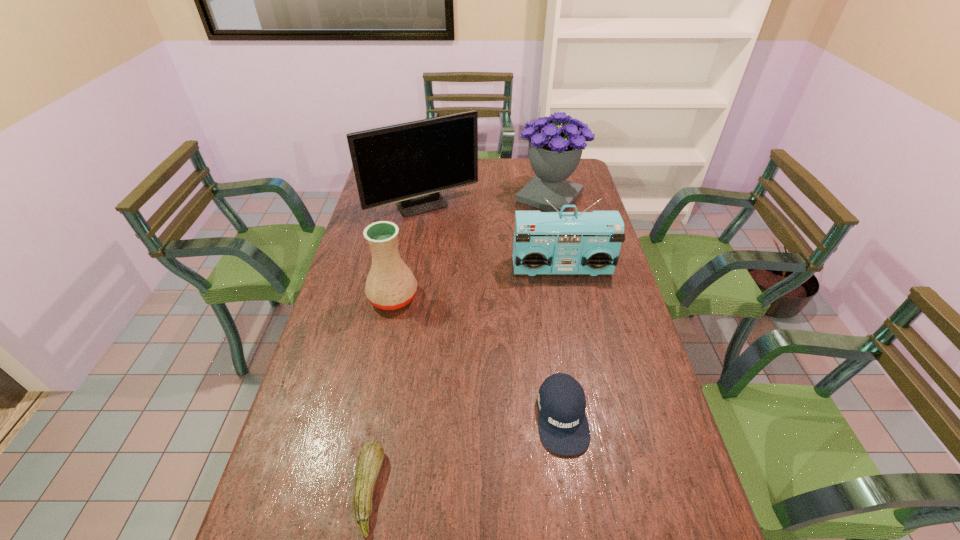
Locate an element on the screen. vacant space at the right edge of the desktop is located at coordinates (634, 357).

The height and width of the screenshot is (540, 960). In order to click on empty location between the baseball cap and the bouquet in this screenshot , I will do `click(556, 307)`.

Locate an element on the screen. The height and width of the screenshot is (540, 960). free space between the pottery and the computer monitor is located at coordinates (408, 252).

At what (x,y) coordinates should I click in order to perform the action: click on vacant area that lies between the shortest object and the bouquet. Please return your answer as a coordinate pair (x, y). This screenshot has height=540, width=960. Looking at the image, I should click on pyautogui.click(x=459, y=343).

Identify the location of unoccupied position between the fifth tallest object and the radio receiver. The height and width of the screenshot is (540, 960). (562, 342).

I want to click on object that is the closest to the radio receiver, so click(x=408, y=164).

Identify which object is the fifth closest to the pottery. Please provide its 2D coordinates. Your answer should be formatted as a tuple, i.e. [(x, y)], where the tuple contains the x and y coordinates of a point satisfying the conditions above.

[(554, 152)]

The height and width of the screenshot is (540, 960). What are the coordinates of `vacant area that satisfies the following two spatial constraints: 1. on the front side of the bouquet; 2. at the stem end of the zucchini` in the screenshot? It's located at (611, 490).

Where is `vacant space that satisfies the following two spatial constraints: 1. on the front-facing side of the radio receiver; 2. at the stem end of the zucchini`? The width and height of the screenshot is (960, 540). vacant space that satisfies the following two spatial constraints: 1. on the front-facing side of the radio receiver; 2. at the stem end of the zucchini is located at coordinates (607, 490).

This screenshot has height=540, width=960. I want to click on free point that satisfies the following two spatial constraints: 1. on the front-facing side of the computer monitor; 2. at the stem end of the zucchini, so click(376, 490).